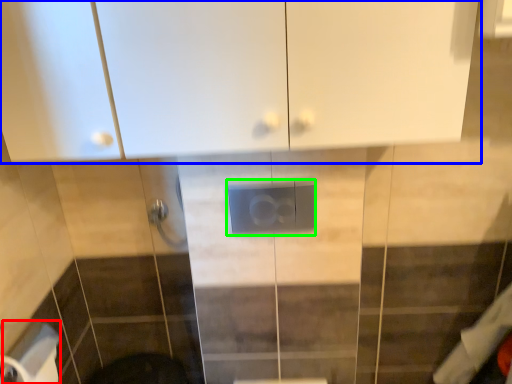
Question: Estimate the real-world distances between objects in this image. Which object is farther from toilet paper (highlighted by a red box), cabinetry (highlighted by a blue box) or electric outlet (highlighted by a green box)?

Choices:
 (A) cabinetry
 (B) electric outlet

Answer: (A)